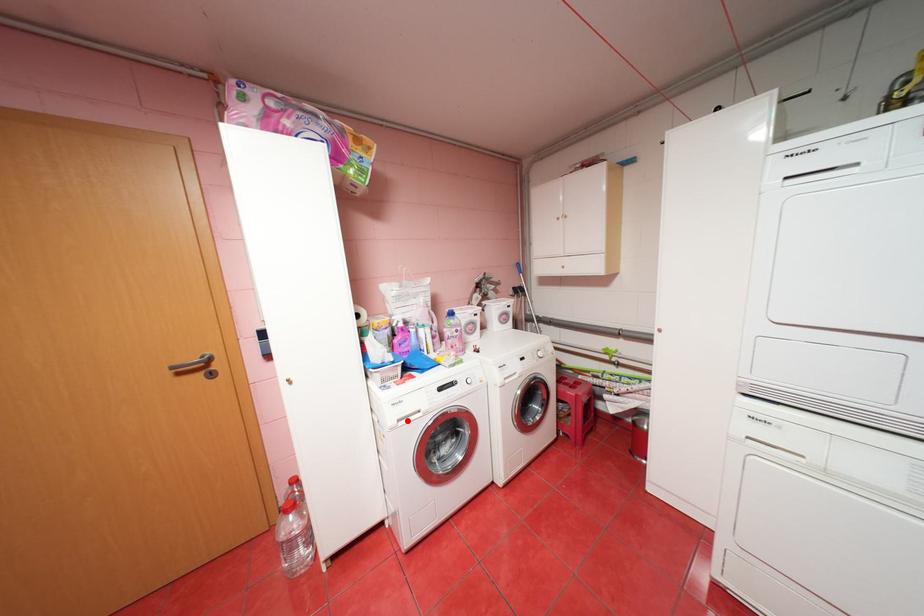
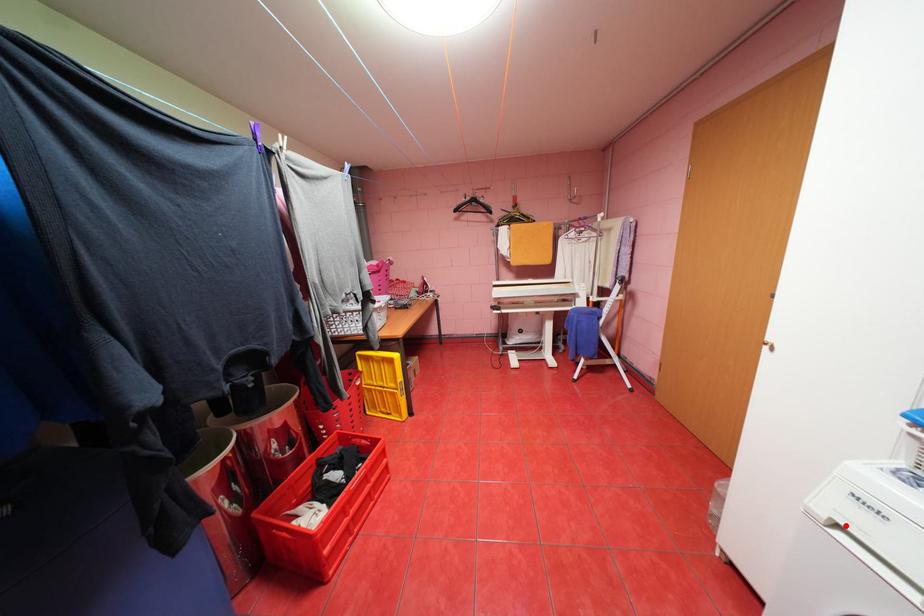
I am providing you with two images of the same scene from different viewpoints. A red point is marked on the first image and another point is marked on the second image. Is the red point in image1 aligned with the point shown in image2?

Yes